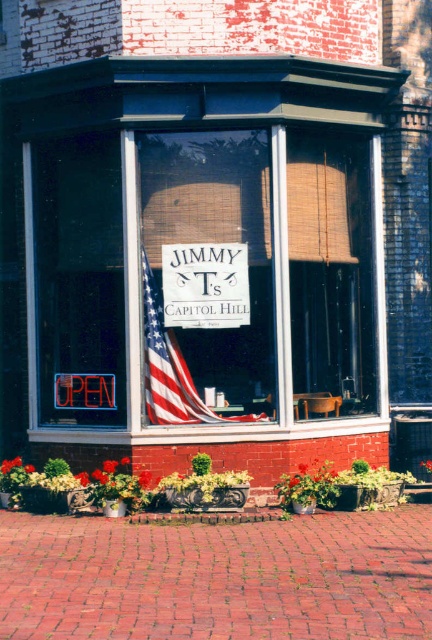
Question: Is white wood sign at center bigger than american flag at center?

Choices:
 (A) yes
 (B) no

Answer: (B)

Question: Which object is closer to the camera taking this photo?

Choices:
 (A) white wood sign at center
 (B) american flag at center

Answer: (A)

Question: Is white wood sign at center to the right of american flag at center from the viewer's perspective?

Choices:
 (A) yes
 (B) no

Answer: (A)

Question: Does white wood sign at center come behind american flag at center?

Choices:
 (A) no
 (B) yes

Answer: (A)

Question: Among these objects, which one is nearest to the camera?

Choices:
 (A) white wood sign at center
 (B) american flag at center

Answer: (A)